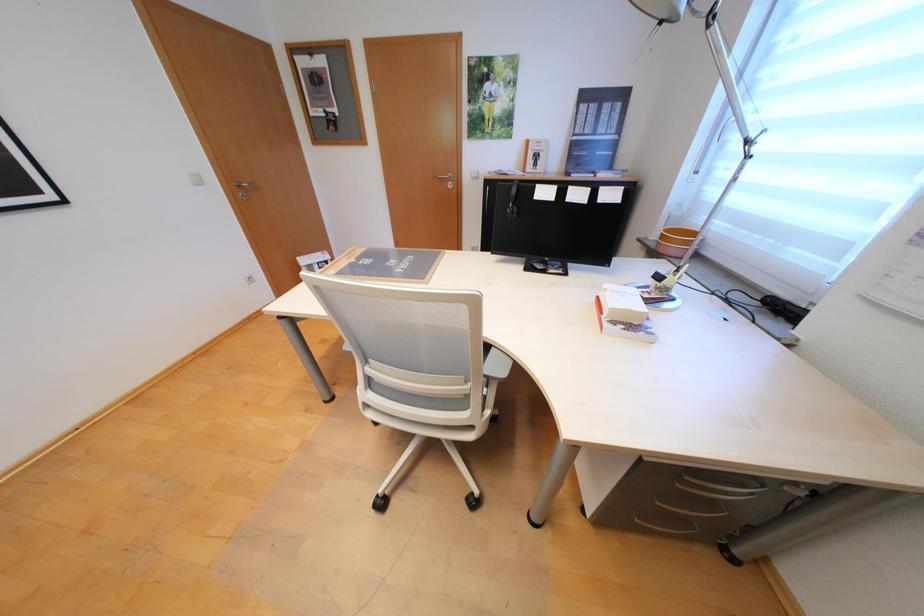
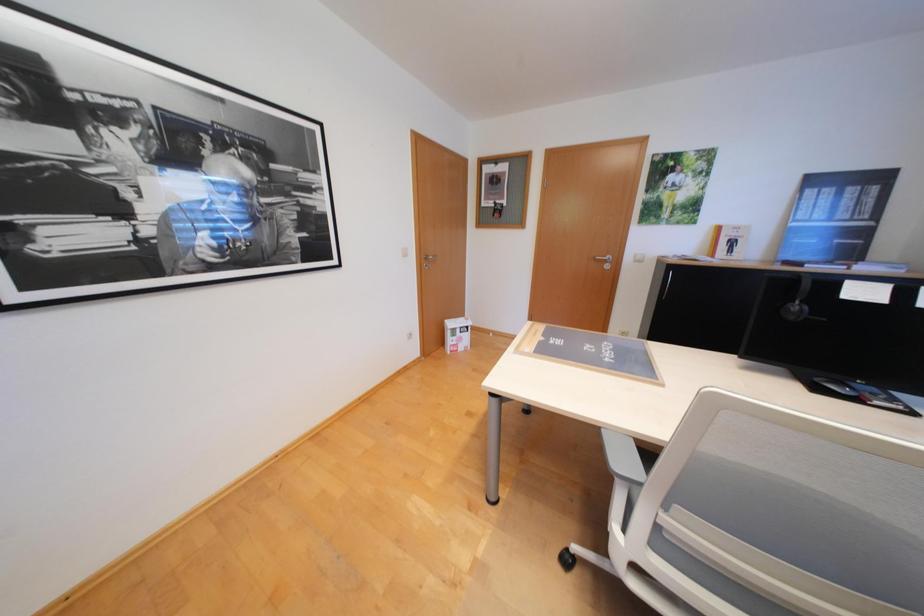
Question: Which direction would the cameraman need to move to produce the second image? Reply with the corresponding letter.

Choices:
 (A) Left
 (B) Right
 (C) Forward
 (D) Backward

Answer: (A)